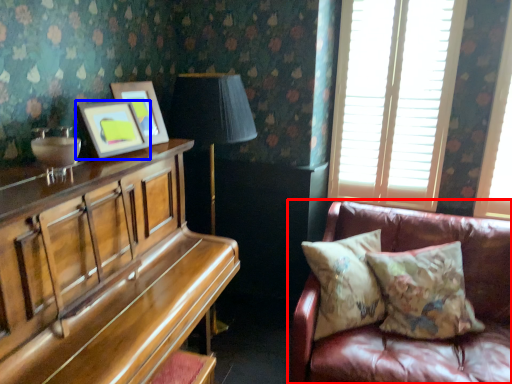
Question: Which object appears farthest to the camera in this image, studio couch (highlighted by a red box) or picture frame (highlighted by a blue box)?

Choices:
 (A) studio couch
 (B) picture frame

Answer: (B)